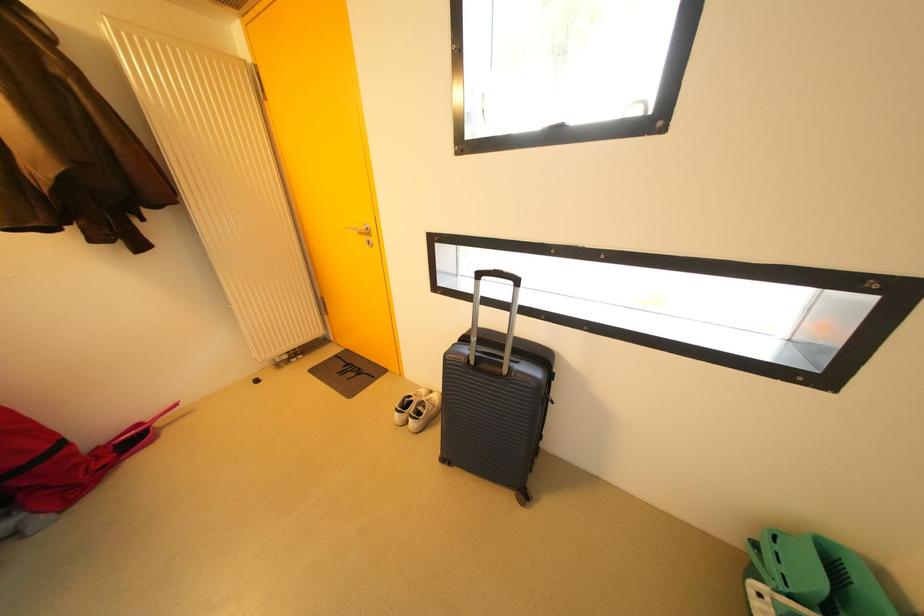
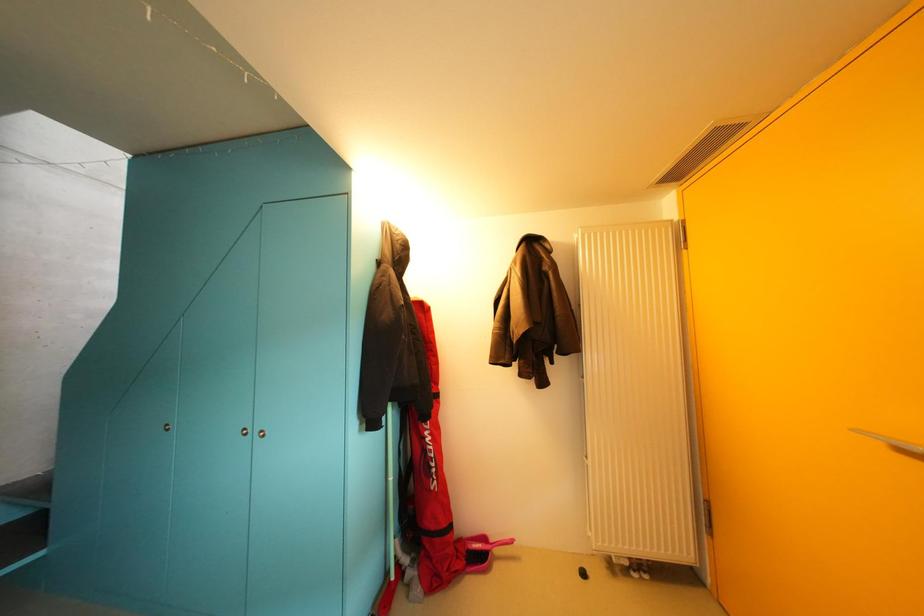
Question: Based on the continuous images, in which direction is the camera rotating? Reply with the corresponding letter.

Choices:
 (A) Left
 (B) Right
 (C) Up
 (D) Down

Answer: (A)